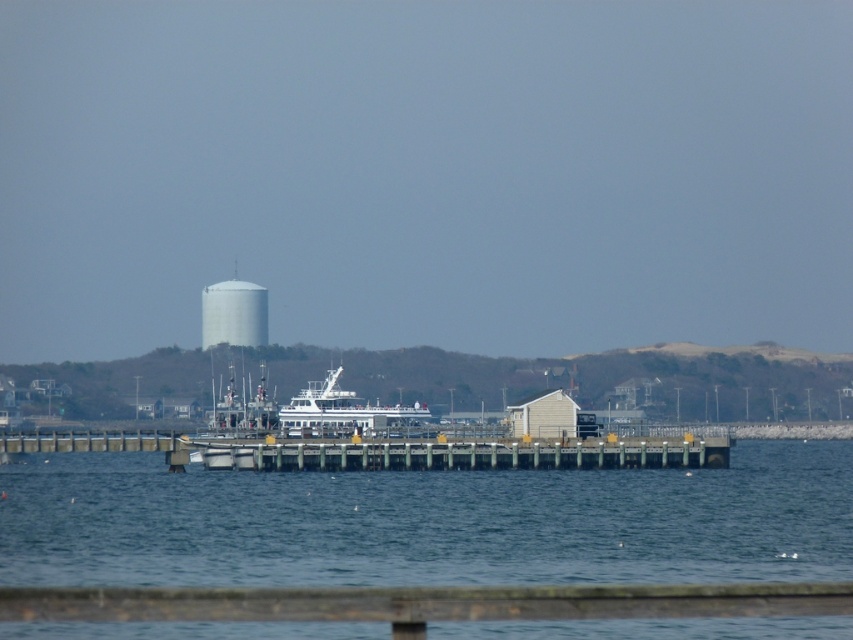
Describe the element at coordinates (427, 524) in the screenshot. The image size is (853, 640). I see `blue water at center` at that location.

Locate an element on the screen. blue water at center is located at coordinates (427, 524).

Consider the image. Who is lower down, wooden dock at center or white matte water tower at center?

wooden dock at center is below.

Is point (345, 452) positioned after point (202, 292)?

No.

Image resolution: width=853 pixels, height=640 pixels. What are the coordinates of `wooden dock at center` in the screenshot? It's located at (460, 454).

The height and width of the screenshot is (640, 853). I want to click on wooden dock at center, so click(460, 454).

Does blue water at center appear over white matte ferry at center?

Yes.

Who is taller, blue water at center or white matte ferry at center?

blue water at center

Is point (410, 488) more distant than point (412, 422)?

That is False.

Locate an element on the screen. blue water at center is located at coordinates (427, 524).